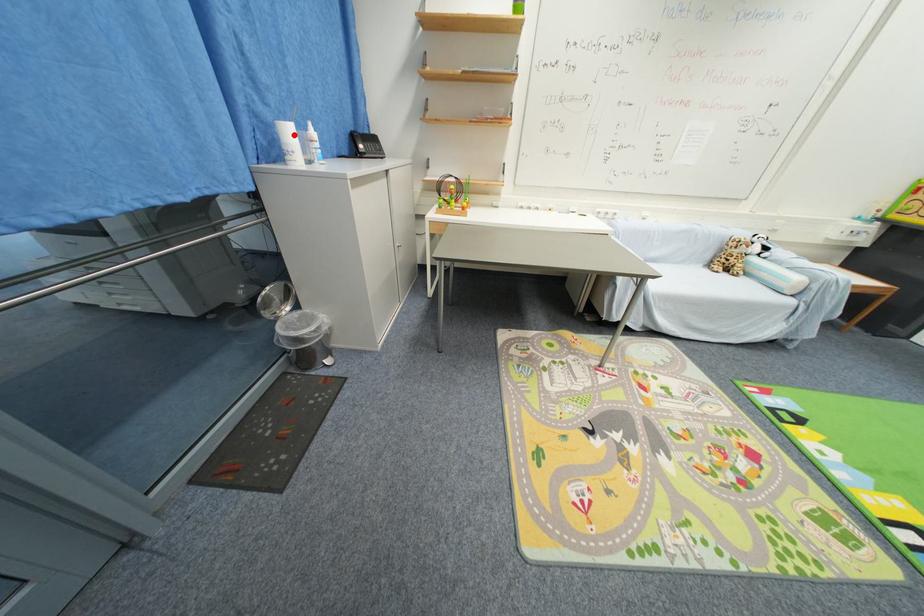
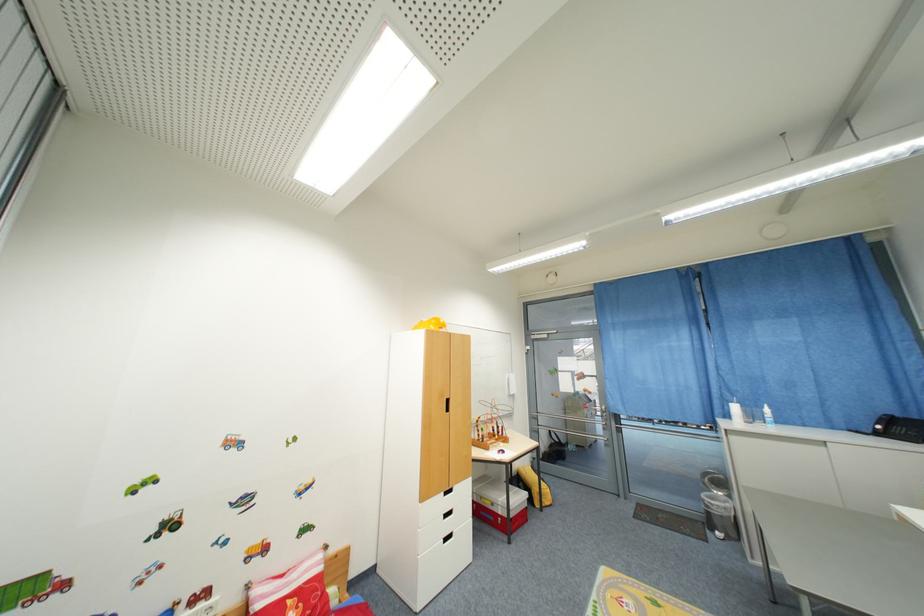
Find the pixel in the second image that matches the highlighted location in the first image.

(740, 410)